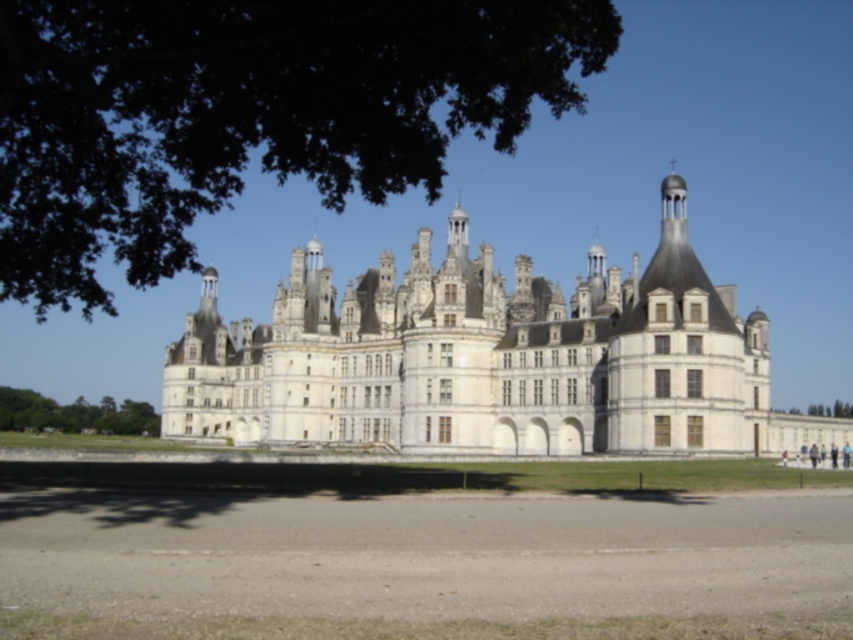
Based on the photo, does dark green leafy tree at upper left appear under white stone castle at center?

No.

Who is higher up, dark green leafy tree at upper left or white stone castle at center?

dark green leafy tree at upper left is above.

Is point (138, 120) farther from camera compared to point (347, 314)?

That is False.

Locate an element on the screen. The height and width of the screenshot is (640, 853). dark green leafy tree at upper left is located at coordinates (248, 113).

Between white stone castle at center and green leafy tree at lower left, which one has less height?

With less height is green leafy tree at lower left.

Which is behind, point (785, 417) or point (122, 410)?

Point (122, 410)

From the picture: Who is more distant from viewer, (619,387) or (30,416)?

Positioned behind is point (30,416).

Where is `white stone castle at center`? Image resolution: width=853 pixels, height=640 pixels. white stone castle at center is located at coordinates (489, 356).

Between dark green leafy tree at upper left and green leafy tree at lower left, which one is positioned higher?

dark green leafy tree at upper left

Between dark green leafy tree at upper left and green leafy tree at lower left, which one appears on the right side from the viewer's perspective?

Positioned to the right is dark green leafy tree at upper left.

You are a GUI agent. You are given a task and a screenshot of the screen. Output one action in this format:
    pyautogui.click(x=<x>, y=<y>)
    Task: Click on the dark green leafy tree at upper left
    The height and width of the screenshot is (640, 853).
    Given the screenshot: What is the action you would take?
    pyautogui.click(x=248, y=113)